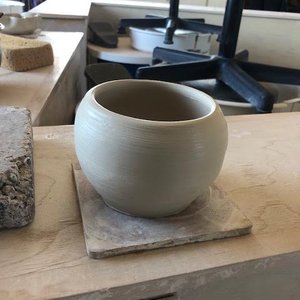
Where is `missing trim`? This screenshot has height=300, width=300. missing trim is located at coordinates (x=217, y=275).